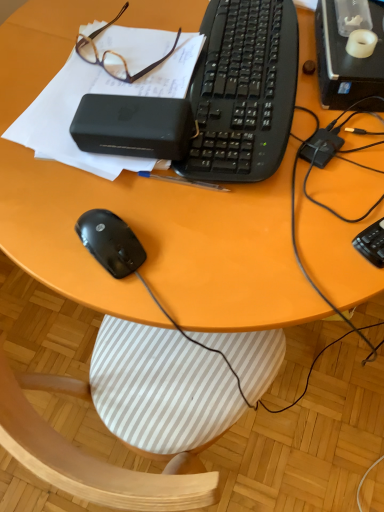
The image size is (384, 512). In order to click on free space behind brown plastic glasses at upper left in this screenshot , I will do `click(129, 10)`.